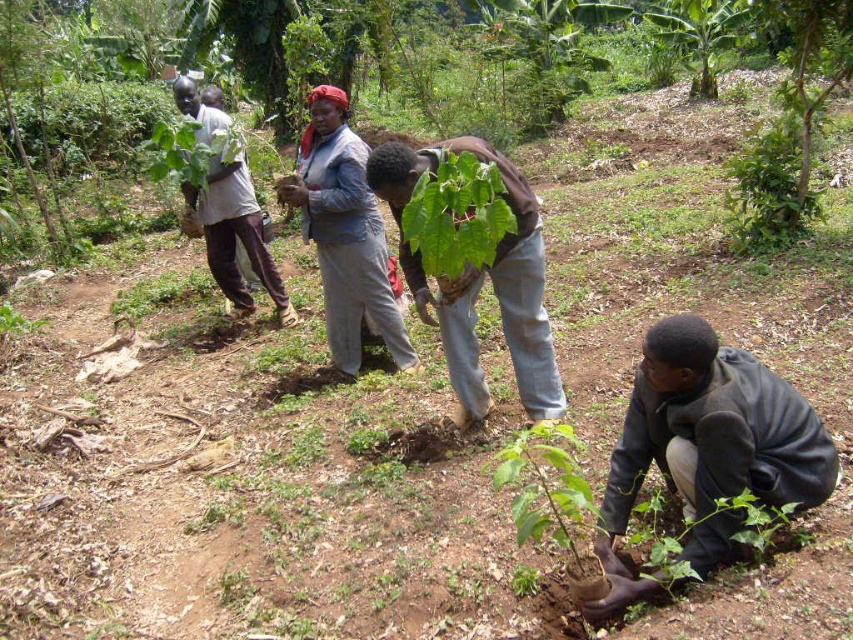
Which of these two, light gray fabric at center or green leafy plant at center, stands taller?

light gray fabric at center

Which of these two, light gray fabric at center or green leafy plant at center, stands shorter?

Standing shorter between the two is green leafy plant at center.

This screenshot has width=853, height=640. I want to click on light gray fabric at center, so click(x=344, y=234).

Where is `green leafy plant at lower center`? green leafy plant at lower center is located at coordinates (546, 488).

Can you confirm if green leafy plant at lower center is positioned below green leafy plant at upper right?

Correct, green leafy plant at lower center is located below green leafy plant at upper right.

Is point (492, 477) in front of point (701, 92)?

Yes, it is.

Locate an element on the screen. green leafy plant at lower center is located at coordinates (546, 488).

In the scene shown: Does green matte plant at center appear under light brown fabric shirt at upper left?

Indeed, green matte plant at center is positioned under light brown fabric shirt at upper left.

Does green matte plant at center have a larger size compared to light brown fabric shirt at upper left?

No, green matte plant at center is not bigger than light brown fabric shirt at upper left.

Which is in front, point (418, 289) or point (225, 124)?

Point (418, 289)

The height and width of the screenshot is (640, 853). What are the coordinates of `green matte plant at center` in the screenshot? It's located at (480, 284).